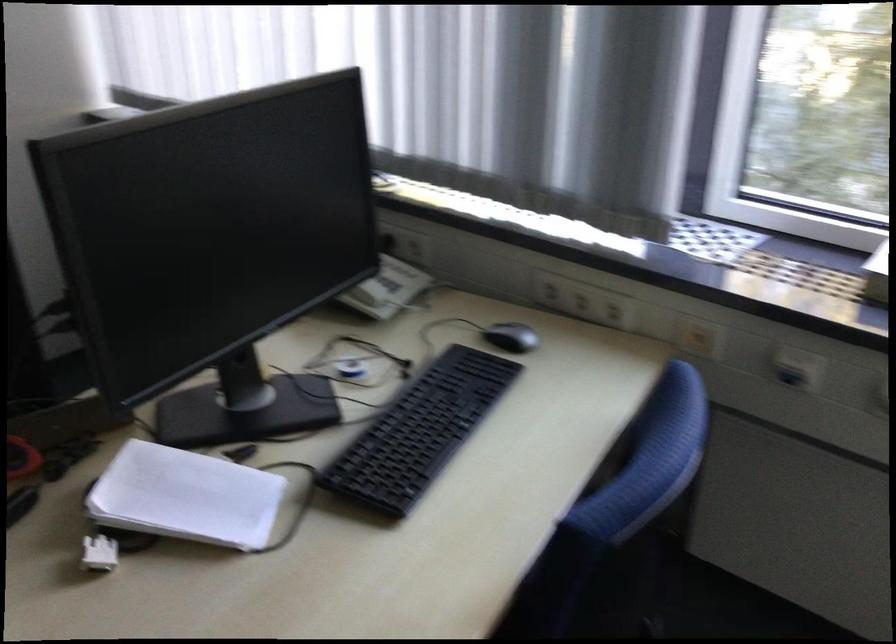
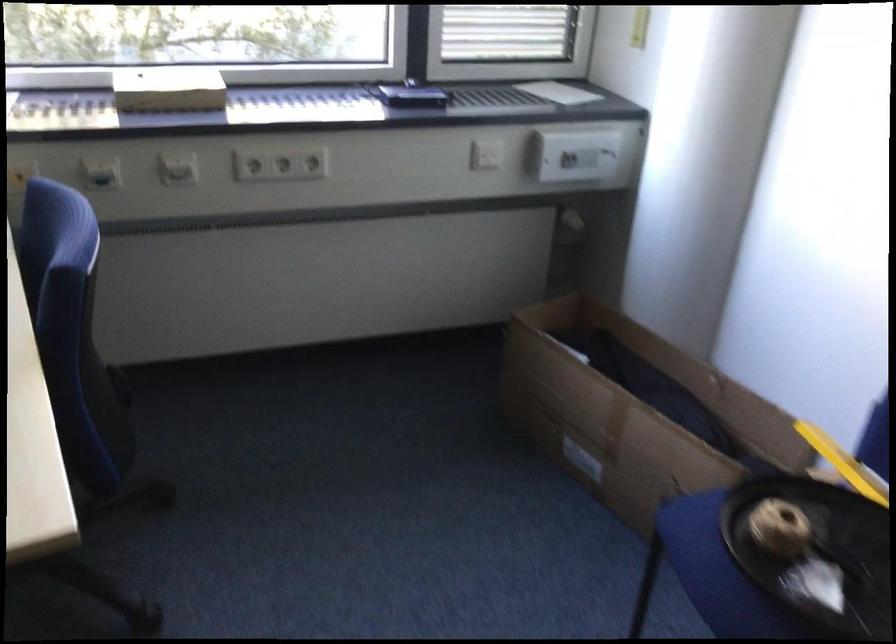
In the second image, find the point that corresponds to (700,325) in the first image.

(20, 174)